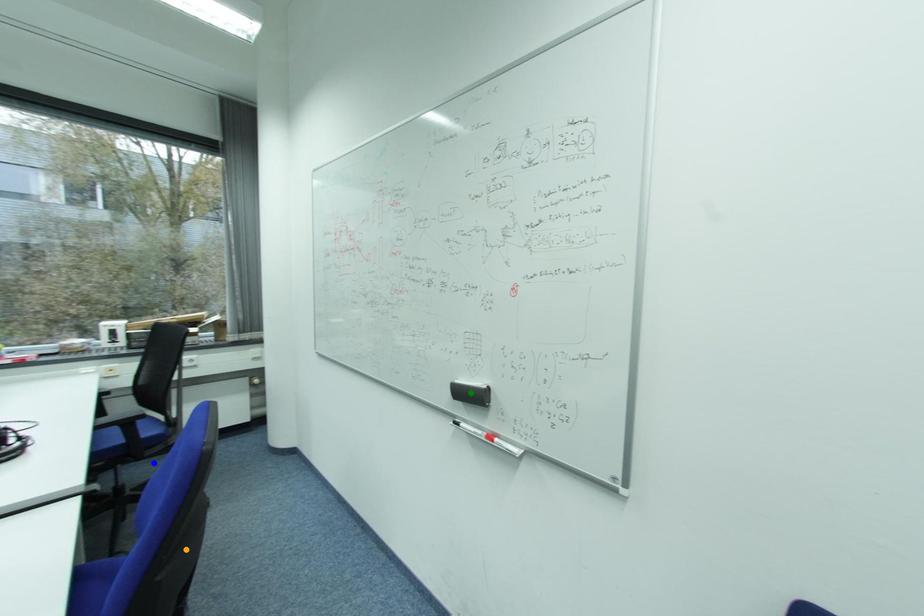
Order these from nearest to farthest:
blue point, orange point, green point

1. orange point
2. green point
3. blue point